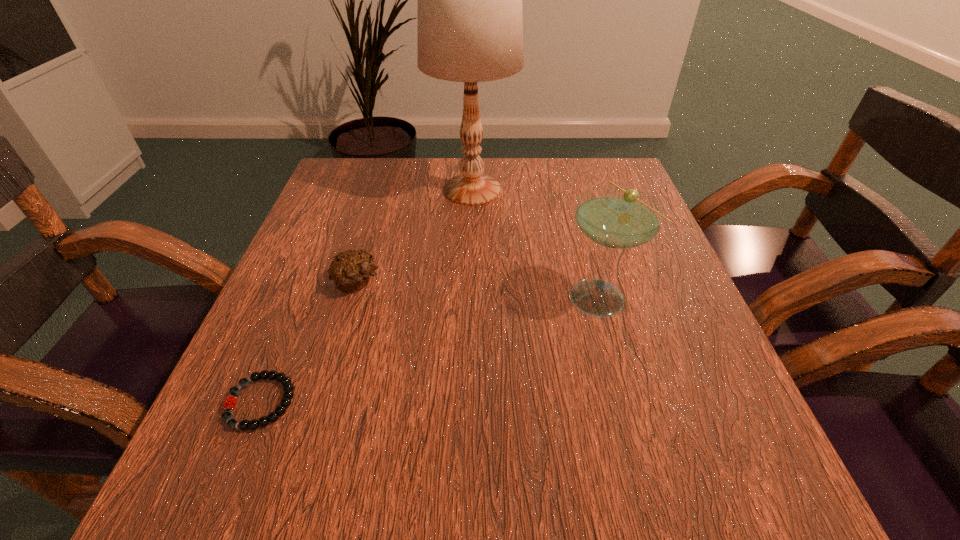
I want to click on the farthest object, so click(x=470, y=23).

Identify the location of the tallest object. pos(470,23).

Where is `the third shortest object`? the third shortest object is located at coordinates (615, 217).

You are a GUI agent. You are given a task and a screenshot of the screen. Output one action in this format:
    pyautogui.click(x=<x>, y=<y>)
    Task: Click on the martini
    Image resolution: width=960 pixels, height=540 pixels.
    Given the screenshot: What is the action you would take?
    pyautogui.click(x=615, y=217)

Locate an element on the screen. Image resolution: width=960 pixels, height=540 pixels. the second shortest object is located at coordinates (350, 270).

Identify the location of bracelet. This screenshot has width=960, height=540. (229, 403).

Find the location of a particular element. the shortest object is located at coordinates (229, 403).

Where is `free space located on the left of the tallest object`? The image size is (960, 540). free space located on the left of the tallest object is located at coordinates (354, 190).

The image size is (960, 540). Identify the location of blank space located 0.070m on the right of the third shortest object. (676, 295).

The height and width of the screenshot is (540, 960). I want to click on vacant space located on the right of the muffin, so click(413, 282).